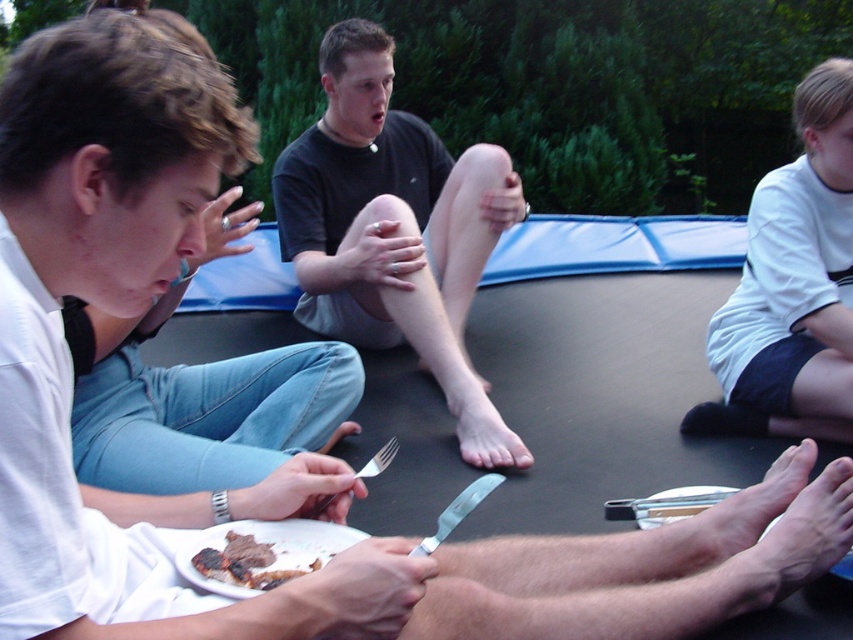
Question: Which is farther from the silver metallic fork at lower center?

Choices:
 (A) white cotton shirt at upper right
 (B) black matte shirt at center
 (C) charred wooden steak at lower center

Answer: (A)

Question: Does white cotton shirt at upper right appear on the right side of silver metallic fork at lower center?

Choices:
 (A) yes
 (B) no

Answer: (A)

Question: From the image, what is the correct spatial relationship of charred wooden steak at lower center in relation to silver metallic fork at lower center?

Choices:
 (A) right
 (B) left

Answer: (B)

Question: Which object is positioned farthest from the white cotton shirt at upper right?

Choices:
 (A) silver metallic fork at lower center
 (B) black matte shirt at center
 (C) charred wooden steak at lower center

Answer: (C)

Question: Does white cotton shirt at upper right have a larger size compared to charred wooden steak at lower center?

Choices:
 (A) no
 (B) yes

Answer: (B)

Question: Which point is farther to the camera?

Choices:
 (A) black matte shirt at center
 (B) silver metallic fork at lower center
 (C) white cotton shirt at upper right
 (D) charred wooden steak at lower center

Answer: (C)